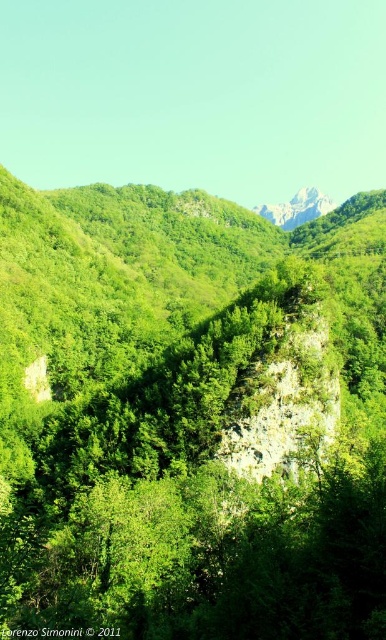
You are standing in a lush forest and want to reach a clearing that is 30 meters ahead. Is the green leafy tree at center in your way?

The green leafy tree at center is 29.90 meters away from the viewer, so it is within the 30 meters distance. Therefore, the green leafy tree at center is in your way.

You are a hiker planning to cross the area between the green leafy tree at center and the white rocky mountain at upper center. Which object is wider, and does this affect your path?

The green leafy tree at center is wider than the white rocky mountain at upper center. This means the tree may block more of the path, so you should plan your route accordingly to navigate around it.

Looking at this image, you are a hiker planning to take a photo of the green leafy tree at center and the white rocky mountain at upper center. From your current position, which object is closer to you?

The green leafy tree at center is closer to you than the white rocky mountain at upper center because it is positioned under it, indicating the tree is in front of the mountain.